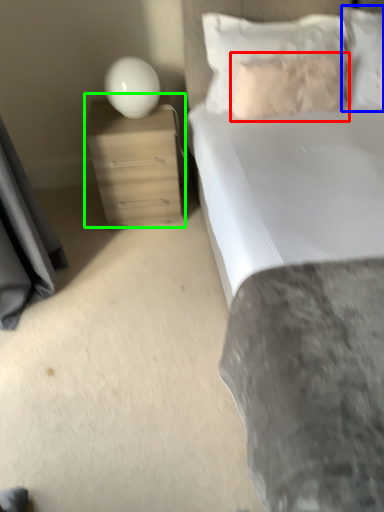
Question: Considering the real-world distances, which object is farthest from pillow (highlighted by a red box)? pillow (highlighted by a blue box) or nightstand (highlighted by a green box)?

Choices:
 (A) pillow
 (B) nightstand

Answer: (B)